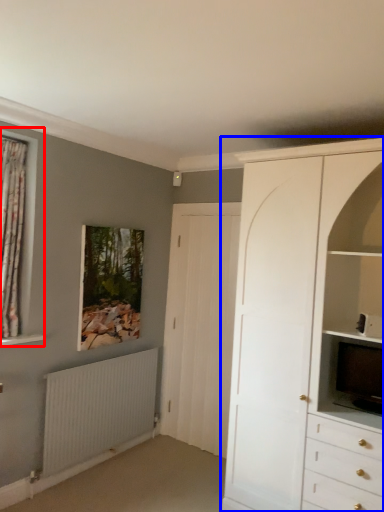
Question: Which object appears closest to the camera in this image, window (highlighted by a red box) or cabinetry (highlighted by a blue box)?

Choices:
 (A) window
 (B) cabinetry

Answer: (B)